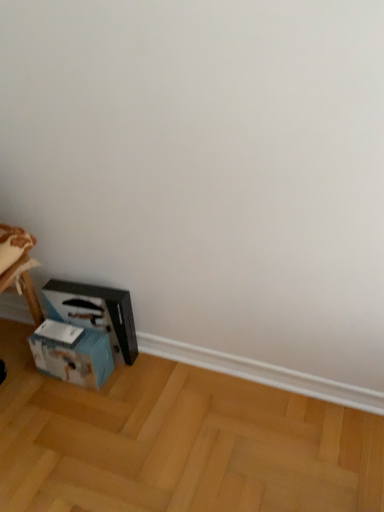
At what (x,y) coordinates should I click in order to perform the action: click on spots to the right of black plastic workbench at lower left. Please return your answer as a coordinate pair (x, y). Image resolution: width=384 pixels, height=512 pixels. Looking at the image, I should click on (150, 371).